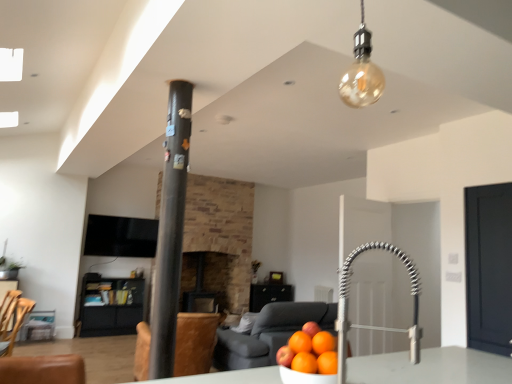
Question: Does amber glass bulb at upper center come behind brown leather swivel chair at center, which ranks as the 1th swivel chair in back-to-front order?

Choices:
 (A) no
 (B) yes

Answer: (A)

Question: Considering the relative sizes of amber glass bulb at upper center and brown leather swivel chair at center, positioned as the second swivel chair in left-to-right order, in the image provided, is amber glass bulb at upper center wider than brown leather swivel chair at center, positioned as the second swivel chair in left-to-right order,?

Choices:
 (A) no
 (B) yes

Answer: (A)

Question: Does amber glass bulb at upper center have a lesser width compared to brown leather swivel chair at center, which is counted as the 2th swivel chair, starting from the front?

Choices:
 (A) no
 (B) yes

Answer: (B)

Question: From a real-world perspective, is amber glass bulb at upper center under brown leather swivel chair at center, which ranks as the 1th swivel chair in back-to-front order?

Choices:
 (A) yes
 (B) no

Answer: (B)

Question: Is amber glass bulb at upper center directly adjacent to brown leather swivel chair at center, which ranks as the 1th swivel chair in back-to-front order?

Choices:
 (A) yes
 (B) no

Answer: (B)

Question: Based on their positions, is satin nickel faucet at center located to the left or right of wooden swivel chair at lower left, which ranks as the first swivel chair in front-to-back order?

Choices:
 (A) left
 (B) right

Answer: (B)

Question: From their relative heights in the image, would you say satin nickel faucet at center is taller or shorter than wooden swivel chair at lower left, which is the 2th swivel chair in back-to-front order?

Choices:
 (A) short
 (B) tall

Answer: (A)

Question: From a real-world perspective, relative to wooden swivel chair at lower left, which is counted as the 1th swivel chair, starting from the left, is satin nickel faucet at center vertically above or below?

Choices:
 (A) below
 (B) above

Answer: (B)

Question: Considering their positions, is satin nickel faucet at center located in front of or behind wooden swivel chair at lower left, which is the 2th swivel chair in back-to-front order?

Choices:
 (A) behind
 (B) front

Answer: (B)

Question: From the image's perspective, is brown leather swivel chair at center, which is counted as the 2th swivel chair, starting from the front, above or below dark brown stone fireplace at center?

Choices:
 (A) above
 (B) below

Answer: (A)

Question: Is brown leather swivel chair at center, positioned as the second swivel chair in left-to-right order, taller or shorter than dark brown stone fireplace at center?

Choices:
 (A) short
 (B) tall

Answer: (A)

Question: Is point (208, 332) positioned closer to the camera than point (229, 304)?

Choices:
 (A) closer
 (B) farther

Answer: (A)

Question: In terms of width, does brown leather swivel chair at center, which ranks as the 1th swivel chair in back-to-front order, look wider or thinner when compared to dark brown stone fireplace at center?

Choices:
 (A) wide
 (B) thin

Answer: (A)

Question: Is point (391, 331) positioned closer to the camera than point (189, 284)?

Choices:
 (A) closer
 (B) farther

Answer: (A)

Question: From the image's perspective, is satin nickel faucet at center located above or below dark brown stone fireplace at center?

Choices:
 (A) above
 (B) below

Answer: (A)